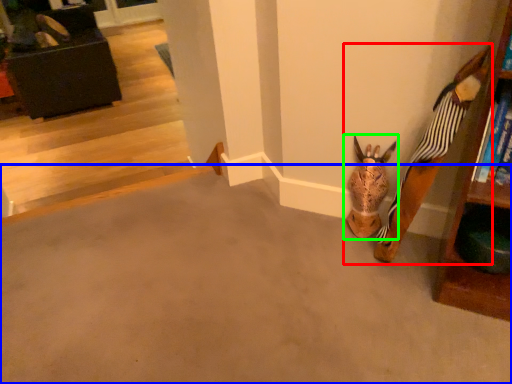
Question: Which is nearer to the toy (highlighted by a red box)? concrete (highlighted by a blue box) or animal (highlighted by a green box).

Choices:
 (A) concrete
 (B) animal

Answer: (B)